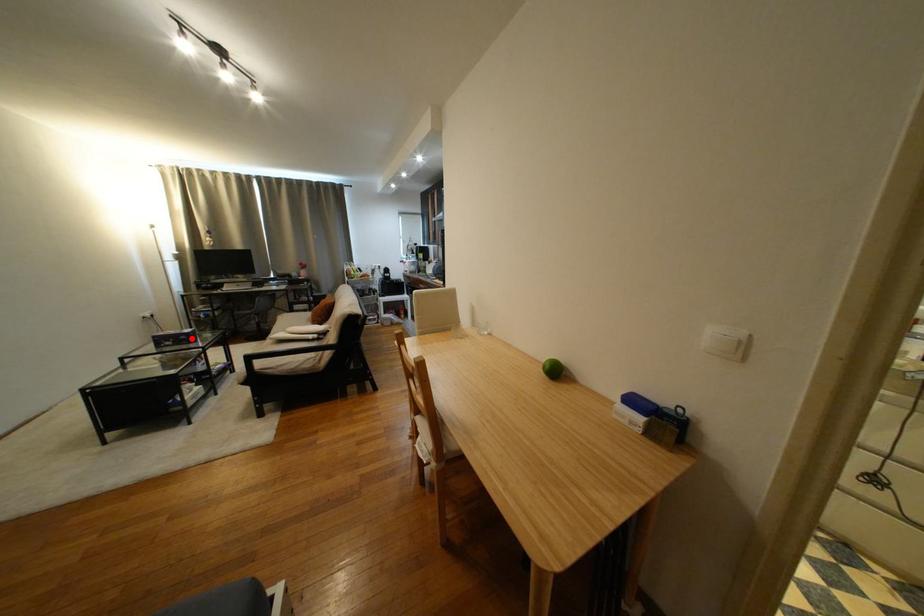
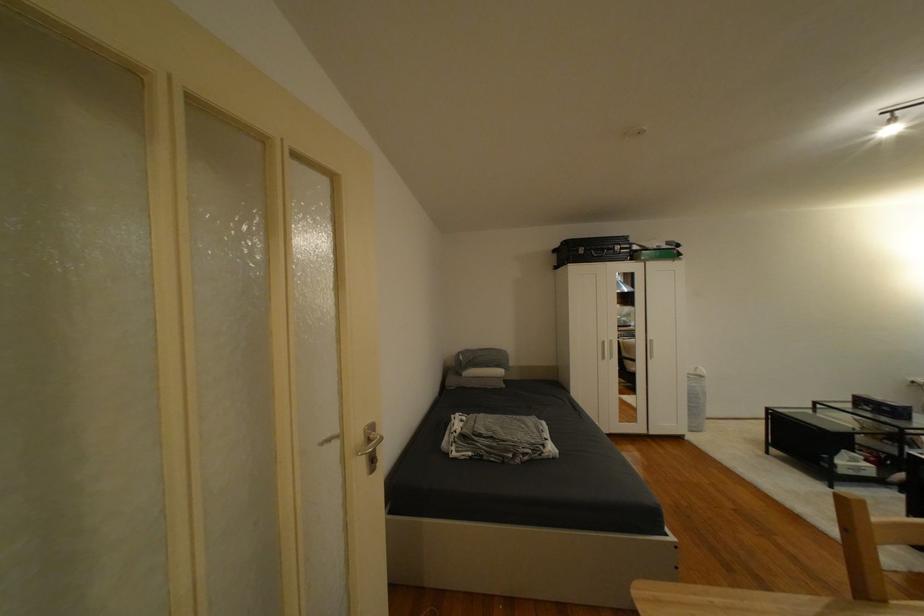
Find the pixel in the second image that matches the highlighted location in the first image.

(894, 410)